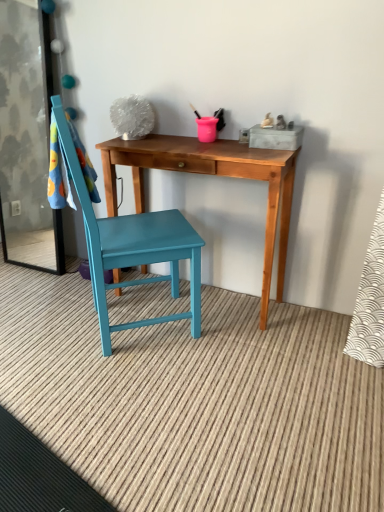
Locate an element on the screen. Image resolution: width=384 pixels, height=512 pixels. wooden desk at center is located at coordinates coord(212,174).

Find the location of a particular element. This screenshot has height=512, width=384. teal painted wood chair at center is located at coordinates (133, 247).

What is the approximate width of transparent glass screen door at left?

It is 4.59 inches.

Locate an element on the screen. Image resolution: width=384 pixels, height=512 pixels. wooden desk at center is located at coordinates (212, 174).

Considering the positions of point (208, 172) and point (20, 265), is point (208, 172) closer or farther from the camera than point (20, 265)?

Point (208, 172) appears to be closer to the viewer than point (20, 265).

From a real-world perspective, is wooden desk at center located higher than transparent glass screen door at left?

No, from a real-world perspective, wooden desk at center is not on top of transparent glass screen door at left.

From the image's perspective, is wooden desk at center on transparent glass screen door at left?

No, from the image's perspective, wooden desk at center is not on top of transparent glass screen door at left.

Is wooden desk at center in front of or behind transparent glass screen door at left in the image?

Clearly, wooden desk at center is in front of transparent glass screen door at left.

From the image's perspective, is transparent glass screen door at left below teal painted wood chair at center?

No.

From a real-world perspective, is transparent glass screen door at left physically above teal painted wood chair at center?

Yes, from a real-world perspective, transparent glass screen door at left is over teal painted wood chair at center

Is teal painted wood chair at center at the back of transparent glass screen door at left?

No, transparent glass screen door at left is not facing away from teal painted wood chair at center.

Based on the photo, in the image, is transparent glass screen door at left positioned in front of or behind teal painted wood chair at center?

transparent glass screen door at left is behind teal painted wood chair at center.

In the scene shown: Which object is thinner, transparent glass screen door at left or wooden desk at center?

Thinner between the two is transparent glass screen door at left.

Image resolution: width=384 pixels, height=512 pixels. What are the coordinates of `table located on the right of transparent glass screen door at left` in the screenshot? It's located at (212, 174).

Is transparent glass screen door at left spatially inside wooden desk at center, or outside of it?

transparent glass screen door at left is not inside wooden desk at center, it's outside.

Considering the relative sizes of transparent glass screen door at left and wooden desk at center in the image provided, is transparent glass screen door at left taller than wooden desk at center?

Yes.

From the image's perspective, which is above, teal painted wood chair at center or wooden desk at center?

From the image's view, teal painted wood chair at center is above.

Do you think teal painted wood chair at center is within wooden desk at center, or outside of it?

The correct answer is: outside.

Between point (141, 257) and point (198, 154), which one is positioned in front?

The point (141, 257) is closer.

What's the angular difference between teal painted wood chair at center and wooden desk at center's facing directions?

The angular difference between teal painted wood chair at center and wooden desk at center is 130 degrees.

Considering the sizes of teal painted wood chair at center and transparent glass screen door at left in the image, is teal painted wood chair at center bigger or smaller than transparent glass screen door at left?

Considering their sizes, teal painted wood chair at center takes up more space than transparent glass screen door at left.

Based on the photo, from the image's perspective, which is above, teal painted wood chair at center or transparent glass screen door at left?

From the image's view, transparent glass screen door at left is above.

Is wooden desk at center not close to teal painted wood chair at center?

No.

How distant is wooden desk at center from teal painted wood chair at center?

Answer: They are 32.40 centimeters apart.

Is wooden desk at center oriented towards teal painted wood chair at center?

Yes, wooden desk at center is facing teal painted wood chair at center.

The width and height of the screenshot is (384, 512). I want to click on screen door on the left of wooden desk at center, so click(x=27, y=139).

Where is `screen door located behind the teal painted wood chair at center`? screen door located behind the teal painted wood chair at center is located at coordinates (27, 139).

From the image, which object appears to be nearer to teal painted wood chair at center, transparent glass screen door at left or wooden desk at center?

wooden desk at center.

Which object lies further to the anchor point wooden desk at center, teal painted wood chair at center or transparent glass screen door at left?

transparent glass screen door at left is positioned further to the anchor wooden desk at center.

From the image, which object appears to be nearer to transparent glass screen door at left, wooden desk at center or teal painted wood chair at center?

teal painted wood chair at center lies closer to transparent glass screen door at left than the other object.

Which object lies further to the anchor point teal painted wood chair at center, wooden desk at center or transparent glass screen door at left?

Based on the image, transparent glass screen door at left appears to be further to teal painted wood chair at center.

Considering their positions, is teal painted wood chair at center positioned closer to transparent glass screen door at left than wooden desk at center?

teal painted wood chair at center is closer to transparent glass screen door at left.

Which object lies nearer to the anchor point wooden desk at center, transparent glass screen door at left or teal painted wood chair at center?

Among the two, teal painted wood chair at center is located nearer to wooden desk at center.

Identify the location of chair between transparent glass screen door at left and wooden desk at center in the horizontal direction. The image size is (384, 512). (133, 247).